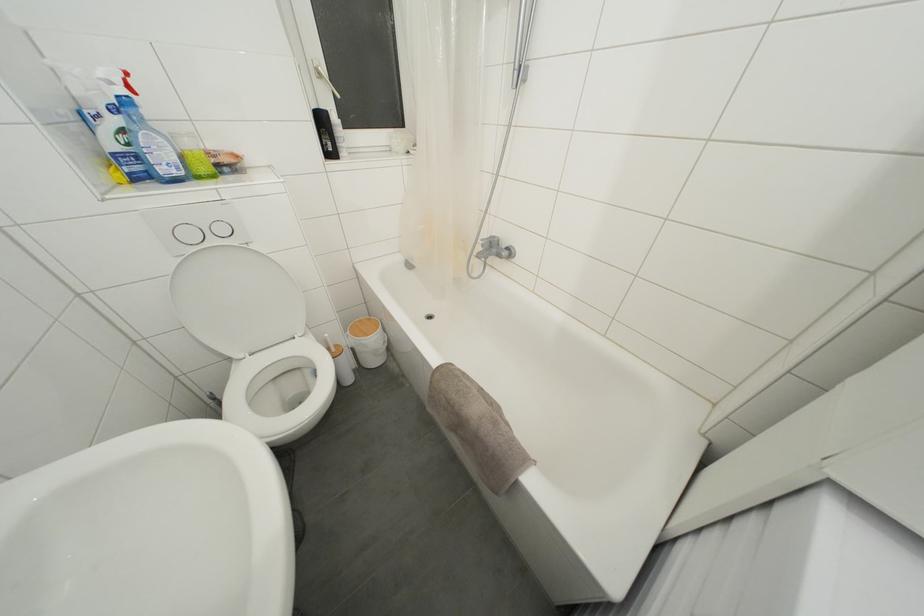
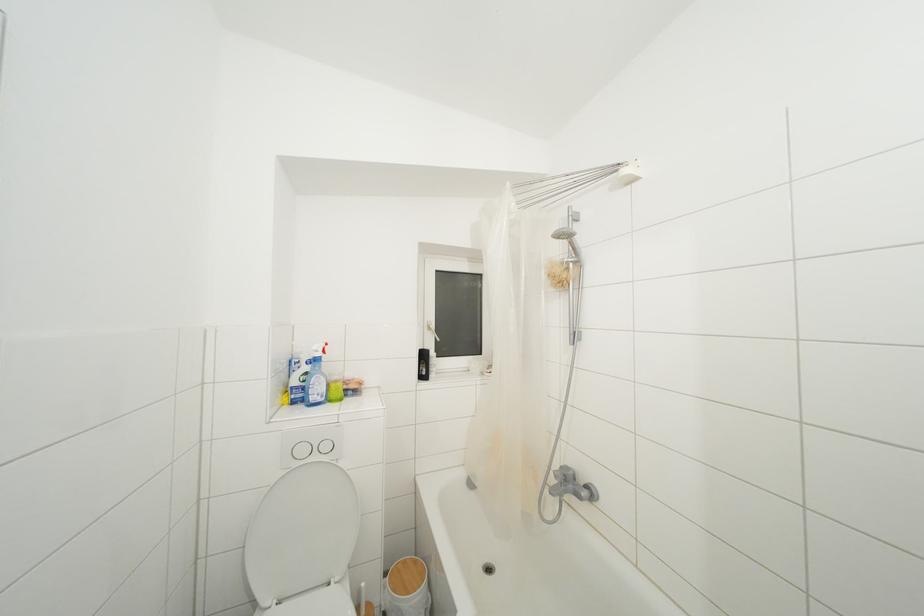
First-person continuous shooting, in which direction is the camera rotating?

The camera rotated toward left-up.